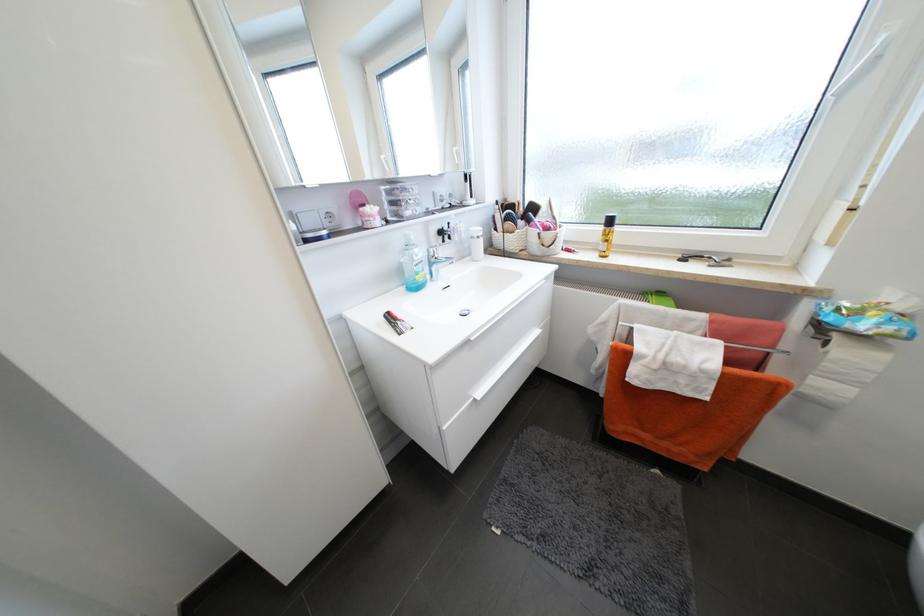
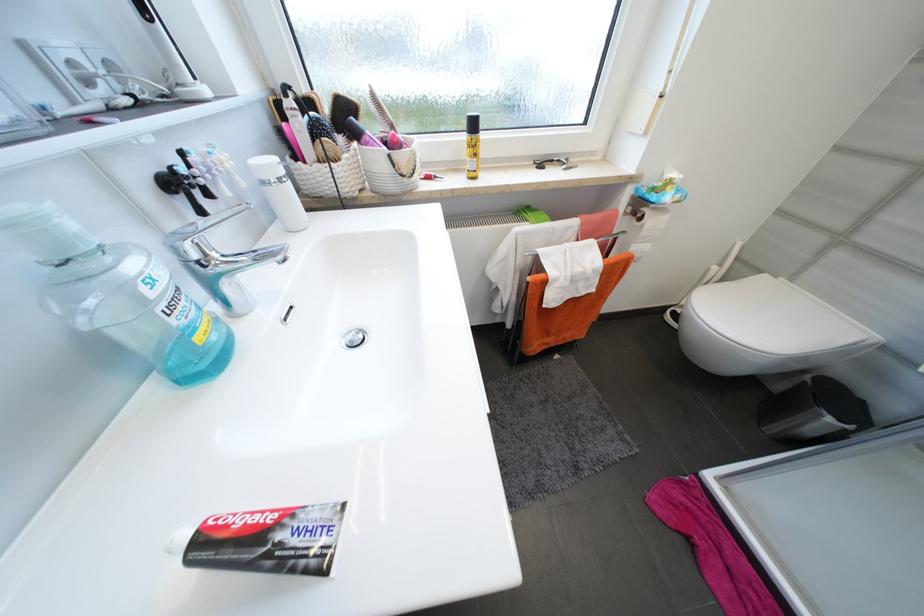
Locate, in the second image, the point that corresponds to point 832,345 in the first image.

(647, 219)